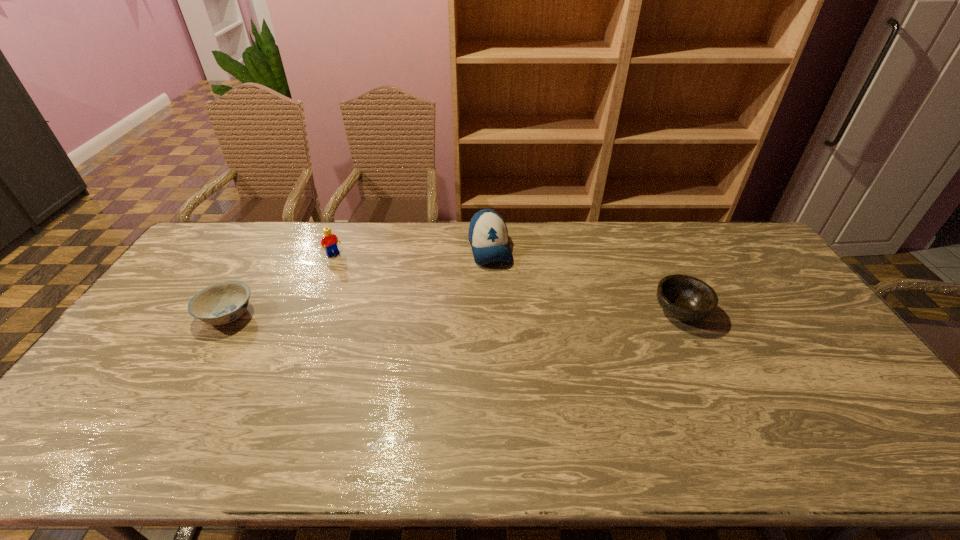
Image resolution: width=960 pixels, height=540 pixels. I want to click on free space on the desktop that is between the leftmost object and the right bowl and is positioned on the front-facing side of the Lego, so click(391, 313).

Locate an element on the screen. vacant space on the desktop that is between the left bowl and the right bowl and is positioned on the front-facing side of the baseball cap is located at coordinates (513, 313).